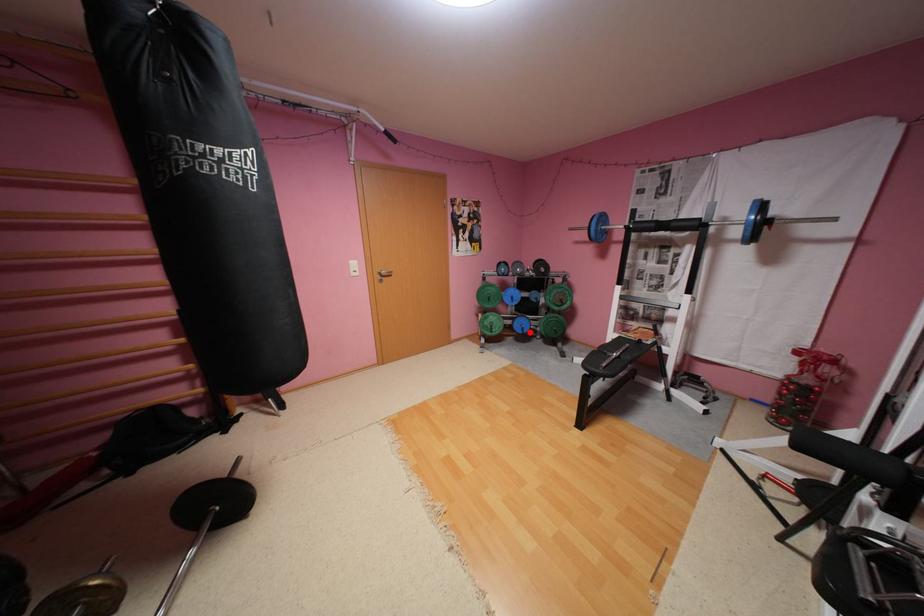
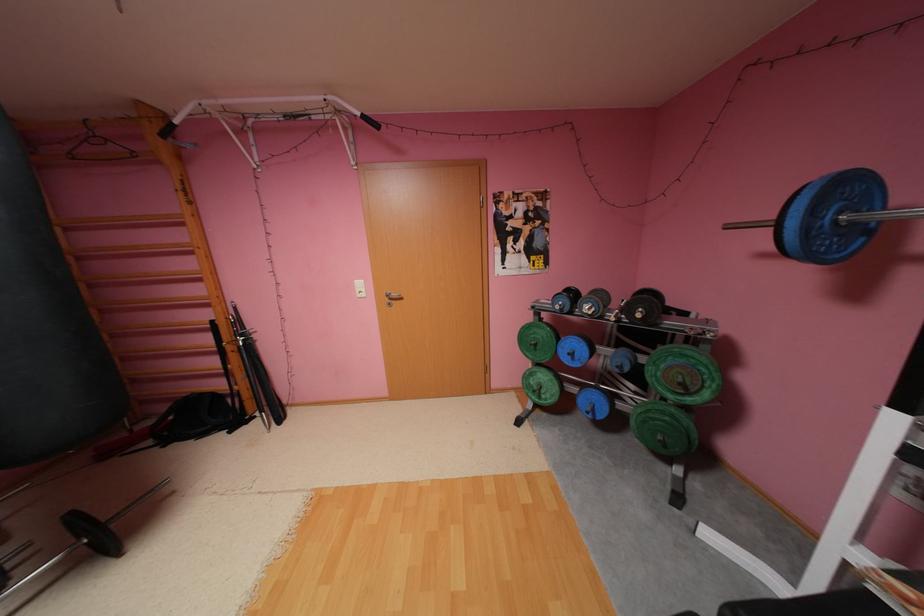
Locate, in the second image, the point that corresponds to the highlighted location in the first image.

(600, 416)